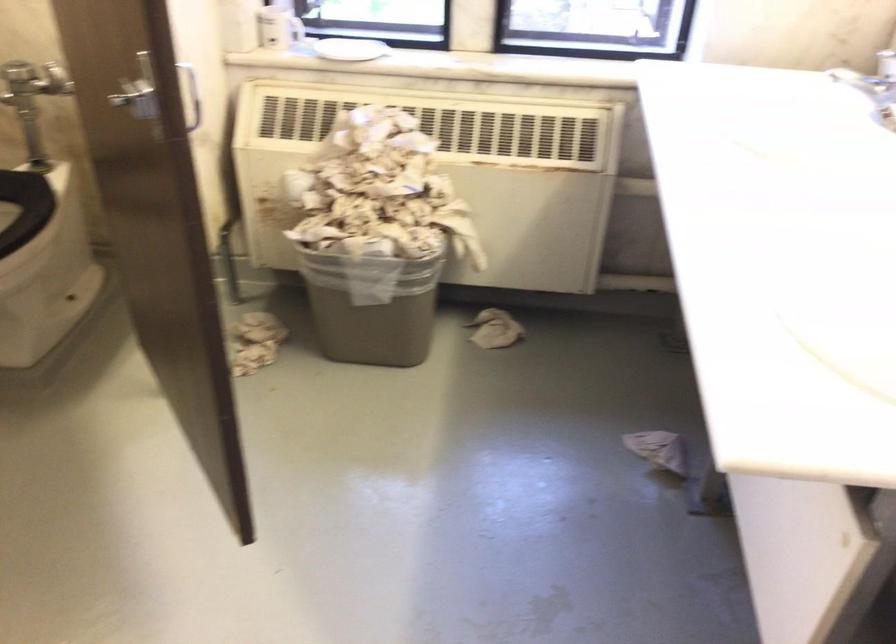
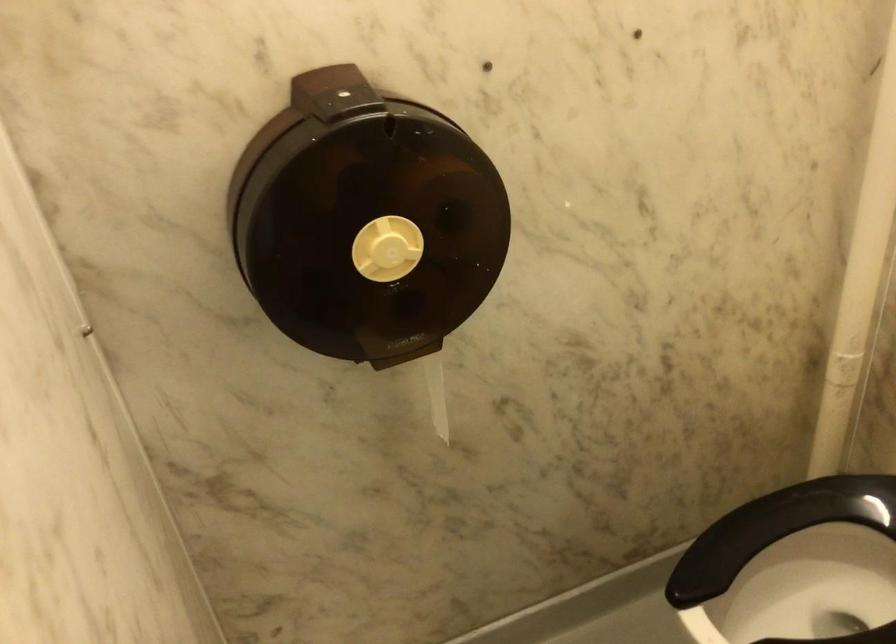
Question: Based on the continuous images, in which direction is the camera rotating? Reply with the corresponding letter.

Choices:
 (A) Left
 (B) Right
 (C) Up
 (D) Down

Answer: (A)